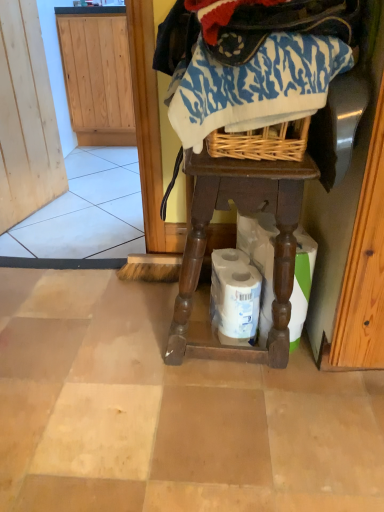
Question: In the image, is brown wooden table at center on the left side or the right side of blue printed fabric at center?

Choices:
 (A) left
 (B) right

Answer: (B)

Question: Based on their sizes in the image, would you say brown wooden table at center is bigger or smaller than blue printed fabric at center?

Choices:
 (A) big
 (B) small

Answer: (A)

Question: Considering the real-world distances, which object is closest to the white matte toilet paper at lower center, which ranks as the 2th toilet paper in left-to-right order?

Choices:
 (A) brown wooden table at center
 (B) white matte toilet paper at lower center, placed as the second toilet paper when sorted from right to left
 (C) blue printed fabric at center

Answer: (B)

Question: Estimate the real-world distances between objects in this image. Which object is closer to the blue printed fabric at center?

Choices:
 (A) brown wooden table at center
 (B) white matte toilet paper at lower center, placed as the second toilet paper when sorted from right to left
 (C) white matte toilet paper at lower center, which ranks as the 1th toilet paper in right-to-left order

Answer: (A)